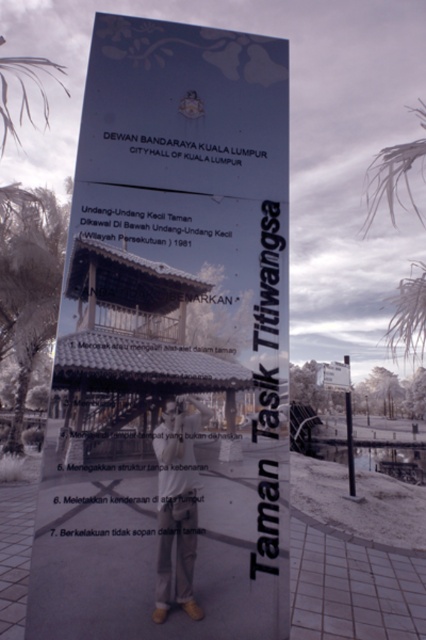
Looking at this image, does transparent plastic sign at center appear on the left side of green leafy palm tree at left?

Incorrect, transparent plastic sign at center is not on the left side of green leafy palm tree at left.

Is transparent plastic sign at center to the right of green leafy palm tree at left from the viewer's perspective?

Yes, transparent plastic sign at center is to the right of green leafy palm tree at left.

Image resolution: width=426 pixels, height=640 pixels. What are the coordinates of `transparent plastic sign at center` in the screenshot? It's located at [170, 346].

Find the location of a particular element. The width and height of the screenshot is (426, 640). transparent plastic sign at center is located at coordinates (170, 346).

Locate an element on the screen. The width and height of the screenshot is (426, 640). green leafy palm tree at left is located at coordinates (28, 284).

Locate an element on the screen. The height and width of the screenshot is (640, 426). green leafy palm tree at left is located at coordinates (28, 284).

Is transparent plastic sign at center taller than white frosty palm tree at upper right?

Yes, transparent plastic sign at center is taller than white frosty palm tree at upper right.

Is point (166, 484) positioned after point (391, 198)?

No, (166, 484) is in front of (391, 198).

Which is in front, point (126, 49) or point (409, 275)?

Point (126, 49) is more forward.

The image size is (426, 640). I want to click on transparent plastic sign at center, so click(170, 346).